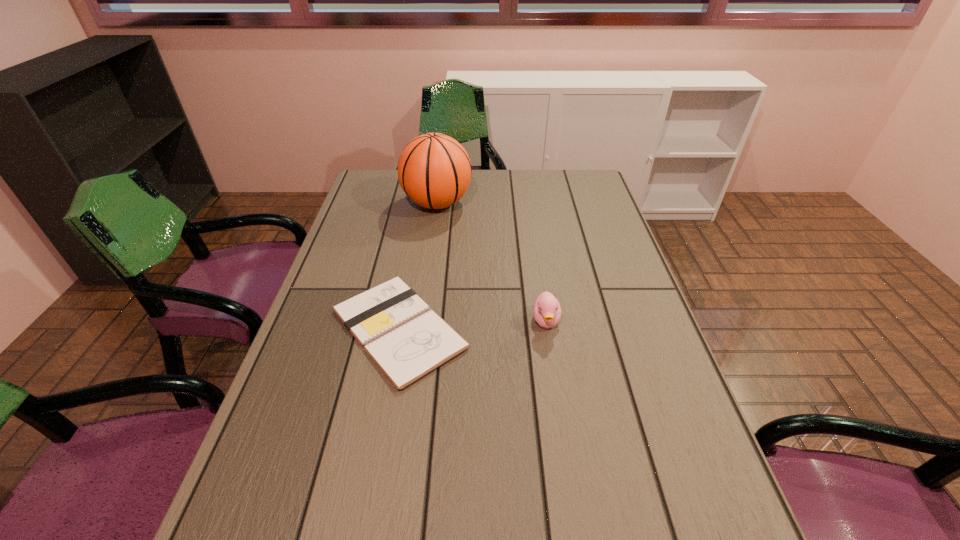
I want to click on the farthest object, so click(434, 170).

Locate an element on the screen. The image size is (960, 540). basketball is located at coordinates (434, 170).

Where is `the rightmost object`? the rightmost object is located at coordinates pos(547,312).

At what (x,y) coordinates should I click in order to perform the action: click on the second tallest object. Please return your answer as a coordinate pair (x, y). This screenshot has width=960, height=540. Looking at the image, I should click on (547, 312).

At what (x,y) coordinates should I click in order to perform the action: click on the shortest object. Please return your answer as a coordinate pair (x, y). Looking at the image, I should click on (407, 341).

The height and width of the screenshot is (540, 960). Find the location of `free space located on the front of the tallest object`. free space located on the front of the tallest object is located at coordinates (429, 259).

Identify the location of free space located 0.220m on the front-facing side of the second tallest object. (562, 422).

The width and height of the screenshot is (960, 540). I want to click on free space located on the right of the shortest object, so click(632, 329).

Find the location of a particular element. Image resolution: width=960 pixels, height=540 pixels. object that is at the far edge is located at coordinates (434, 170).

Identify the location of basketball that is at the left edge. The height and width of the screenshot is (540, 960). (434, 170).